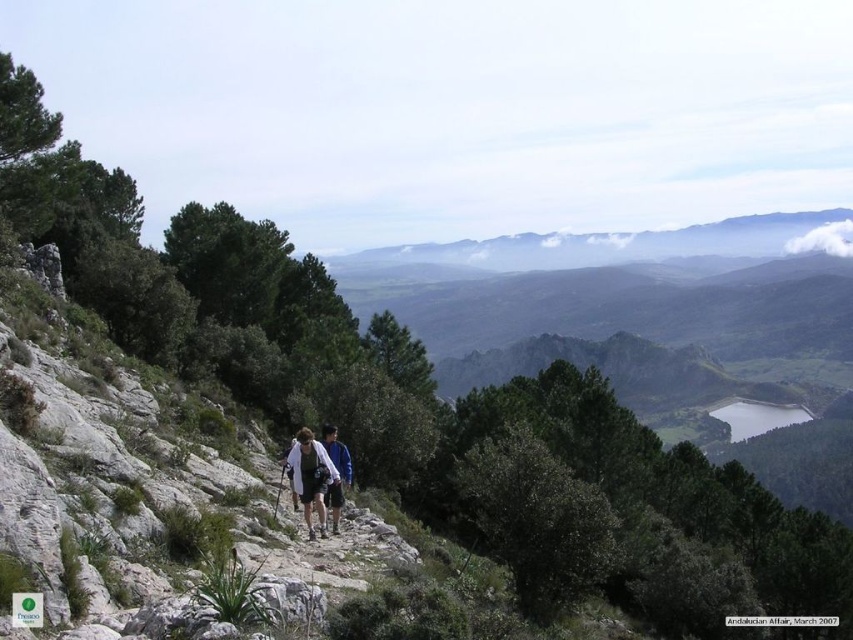
Question: Can you confirm if white fabric jacket at center is bigger than blue fabric jacket at center?

Choices:
 (A) yes
 (B) no

Answer: (A)

Question: Can you confirm if white fabric jacket at center is thinner than blue fabric jacket at center?

Choices:
 (A) no
 (B) yes

Answer: (A)

Question: Is white fabric jacket at center smaller than blue fabric jacket at center?

Choices:
 (A) yes
 (B) no

Answer: (B)